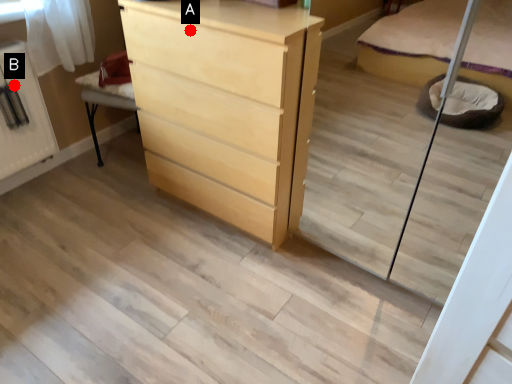
Question: Two points are circled on the image, labeled by A and B beside each circle. Which point appears farthest from the camera in this image?

Choices:
 (A) A is further
 (B) B is further

Answer: (B)